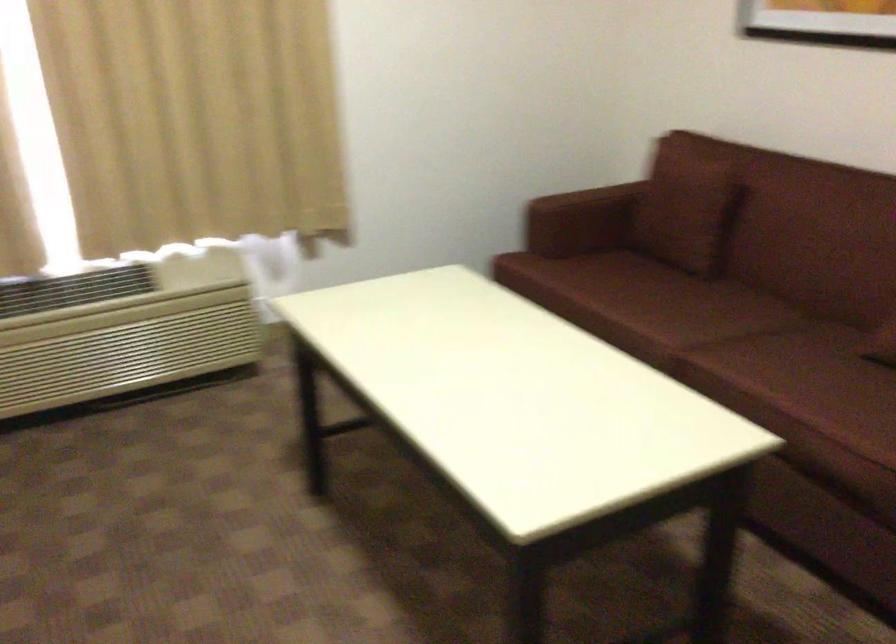
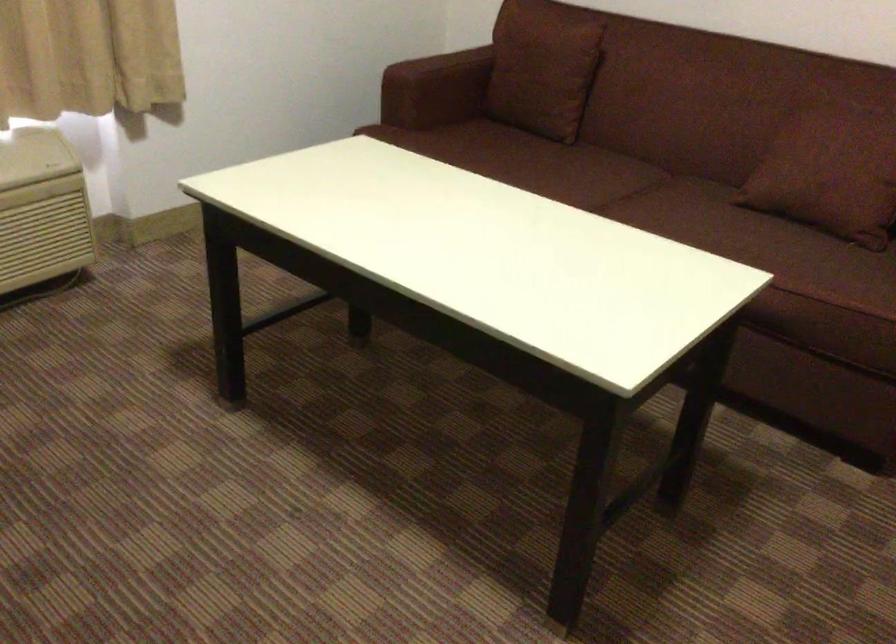
Question: I am providing you with two images of the same scene from different viewpoints. After the viewpoint changes to image2, which objects are now occluded?

Choices:
 (A) sofa sitting surface
 (B) brown sofa pillow
 (C) sofa armrest
 (D) none of these

Answer: (D)